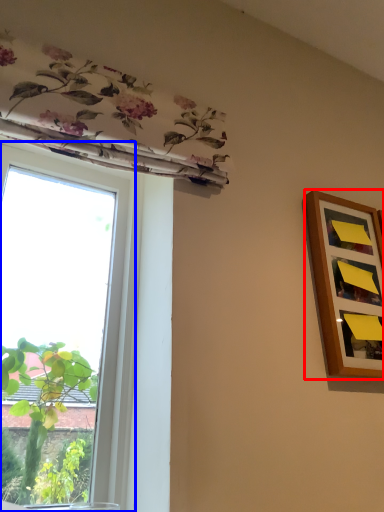
Question: Which of the following is the farthest to the observer, picture frame (highlighted by a red box) or window (highlighted by a blue box)?

Choices:
 (A) picture frame
 (B) window

Answer: (A)